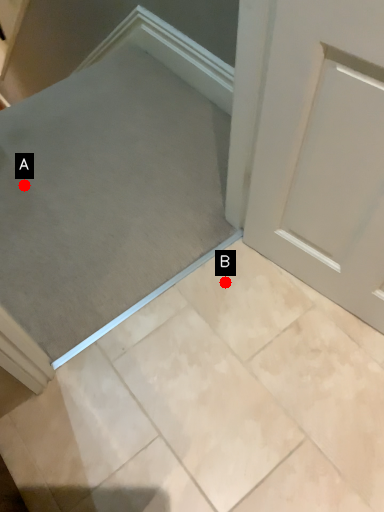
Question: Two points are circled on the image, labeled by A and B beside each circle. Which of the following is the farthest from the observer?

Choices:
 (A) A is further
 (B) B is further

Answer: (A)